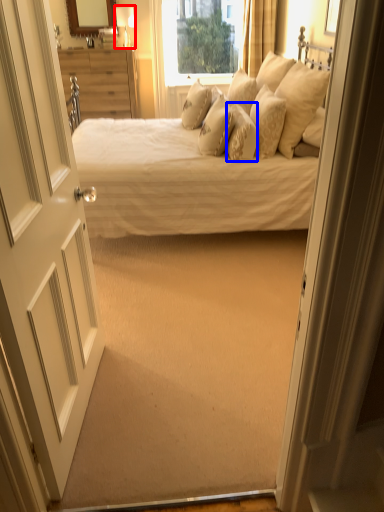
Question: Which object is closer to the camera taking this photo, lamp (highlighted by a red box) or pillow (highlighted by a blue box)?

Choices:
 (A) lamp
 (B) pillow

Answer: (B)